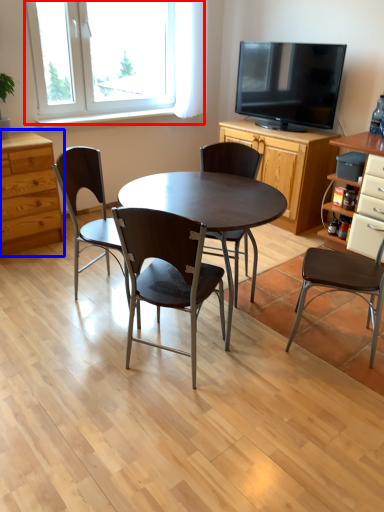
Question: Which point is further to the camera, window (highlighted by a red box) or chest of drawers (highlighted by a blue box)?

Choices:
 (A) window
 (B) chest of drawers

Answer: (A)